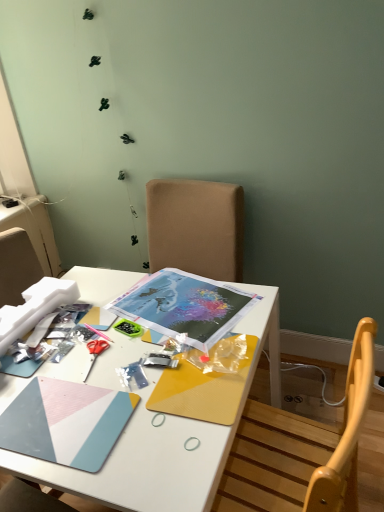
Locate an element on the screen. The height and width of the screenshot is (512, 384). free point to the right of red plastic scissors at center-left is located at coordinates (154, 352).